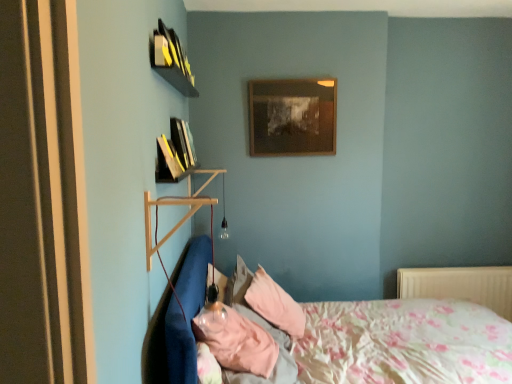
Question: Considering the positions of point (498, 289) and point (260, 299), is point (498, 289) closer or farther from the camera than point (260, 299)?

Choices:
 (A) closer
 (B) farther

Answer: (B)

Question: In terms of height, does white plastic radiator at lower right look taller or shorter compared to pink fabric pillow at lower center?

Choices:
 (A) short
 (B) tall

Answer: (B)

Question: Which object is positioned farthest from the pink fabric pillow at lower center?

Choices:
 (A) white plastic radiator at lower right
 (B) hardcover books at upper left, the 2th book viewed from the back
 (C) wooden picture frame at upper center
 (D) wooden shelf at left
 (E) hardcover book at upper left, placed as the 2th book when sorted from front to back

Answer: (A)

Question: Estimate the real-world distances between objects in this image. Which object is closer to the wooden picture frame at upper center?

Choices:
 (A) wooden shelf at left
 (B) floral fabric bed at lower right
 (C) hardcover book at upper left, which ranks as the 1th book in back-to-front order
 (D) hardcover books at upper left, which is counted as the first book, starting from the front
 (E) white plastic radiator at lower right

Answer: (A)